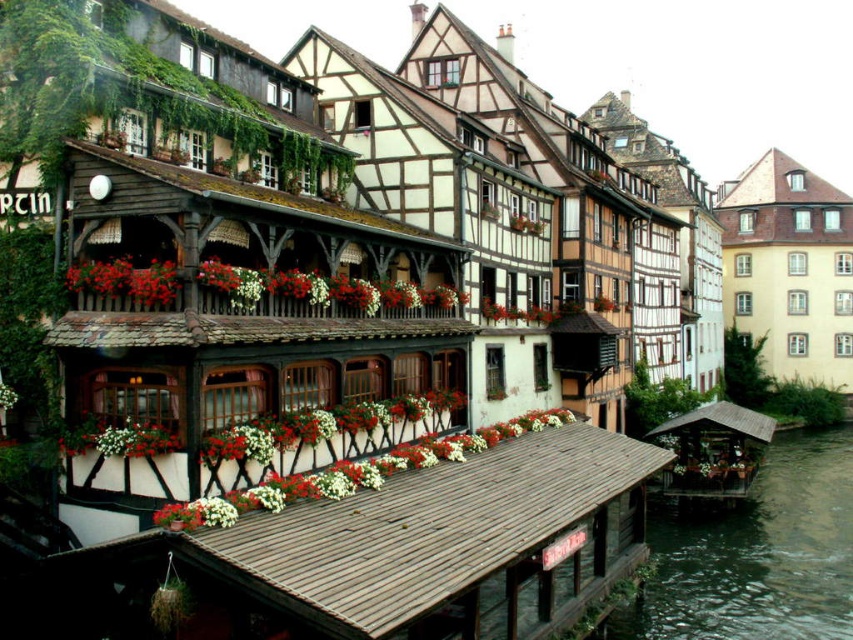
Is greenish water at lower right wider than white matte flower at center?

Correct, the width of greenish water at lower right exceeds that of white matte flower at center.

Which is more to the right, greenish water at lower right or white matte flower at center?

From the viewer's perspective, greenish water at lower right appears more on the right side.

Is point (787, 477) more distant than point (7, 401)?

Yes, point (787, 477) is farther from viewer.

I want to click on greenish water at lower right, so click(x=753, y=554).

Who is shorter, white matte flower box at center or white matte flower at center?

With less height is white matte flower box at center.

Can you confirm if white matte flower box at center is positioned to the right of white matte flower at center?

Correct, you'll find white matte flower box at center to the right of white matte flower at center.

Is point (160, 440) less distant than point (10, 406)?

That is True.

At what (x,y) coordinates should I click in order to perform the action: click on white matte flower box at center. Please return your answer as a coordinate pair (x, y). The image size is (853, 640). Looking at the image, I should click on (119, 438).

Which is in front, point (97, 468) or point (125, 260)?

Positioned in front is point (97, 468).

Is white matte flower at lower left smaller than vivid red petals at center?

Indeed, white matte flower at lower left has a smaller size compared to vivid red petals at center.

The width and height of the screenshot is (853, 640). I want to click on white matte flower at lower left, so (131, 474).